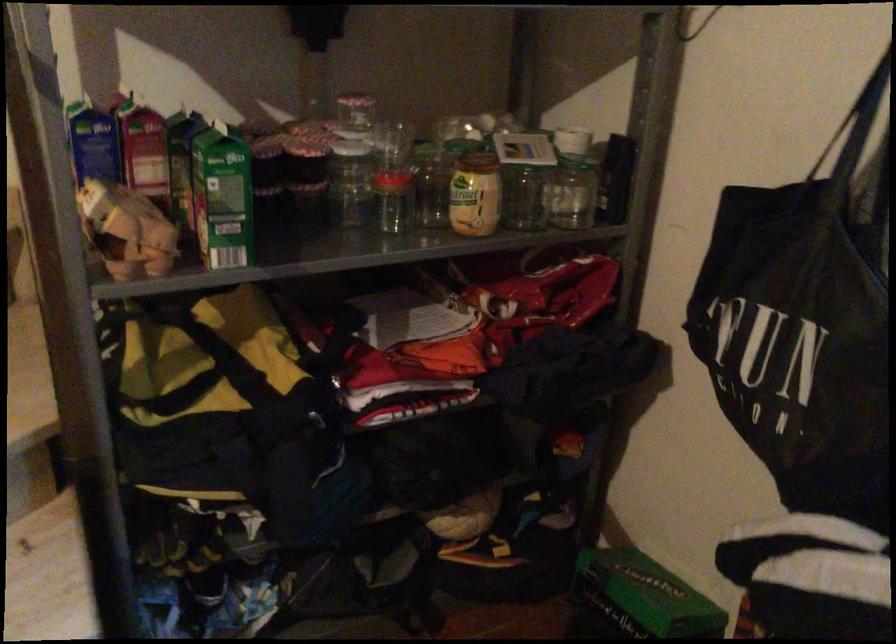
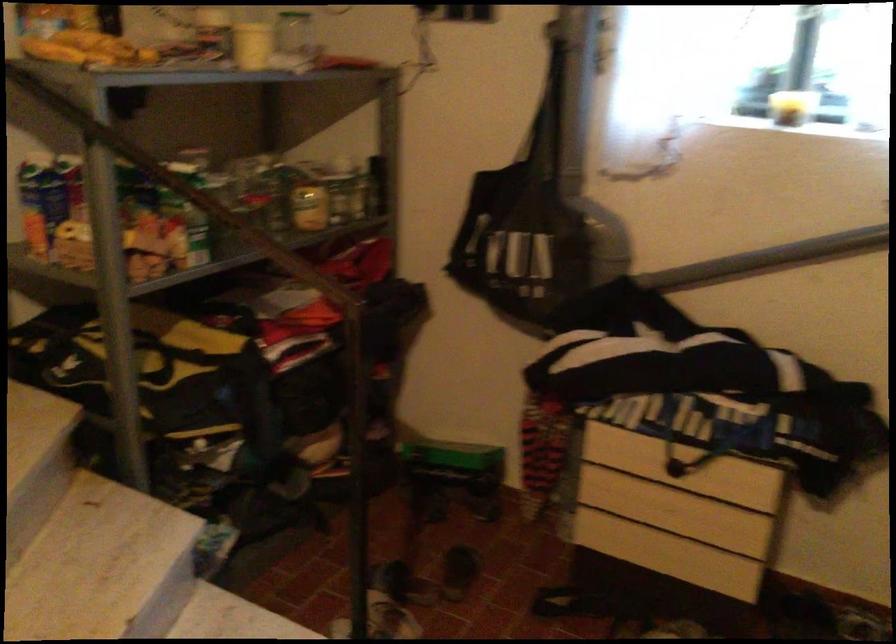
Locate, in the second image, the point that corresponds to point 791,301 in the first image.

(526, 223)